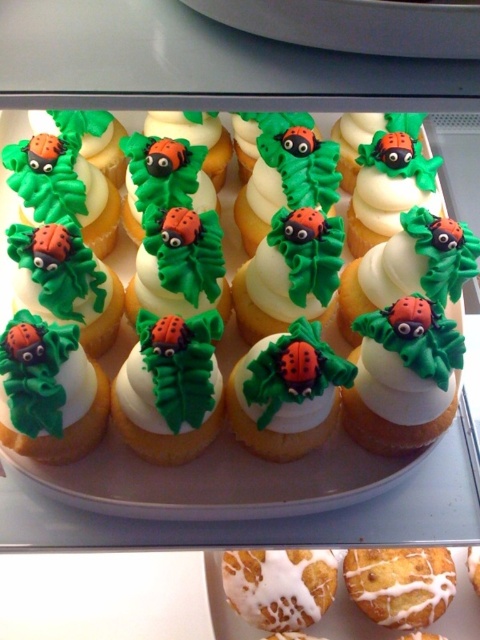
Question: Can you confirm if matte white cupcake at center is wider than white glazed donut at center?

Choices:
 (A) yes
 (B) no

Answer: (A)

Question: Which of these objects is positioned farthest from the matte white cupcake at center?

Choices:
 (A) matte green leaf at center
 (B) matte green frosting at center
 (C) iced white bun at center
 (D) white glazed donut at center

Answer: (C)

Question: Can you confirm if matte white cupcake at center is smaller than iced white bun at center?

Choices:
 (A) yes
 (B) no

Answer: (B)

Question: Which object is the closest to the white glazed donut at center?

Choices:
 (A) matte green frosting at center
 (B) matte green leaf at center
 (C) iced white bun at center

Answer: (C)

Question: Is matte white cupcake at center to the left of matte orange ladybug at center from the viewer's perspective?

Choices:
 (A) yes
 (B) no

Answer: (A)

Question: Based on their relative distances, which object is farther from the white glazed donut at center?

Choices:
 (A) matte orange ladybug at center
 (B) iced white bun at center

Answer: (A)